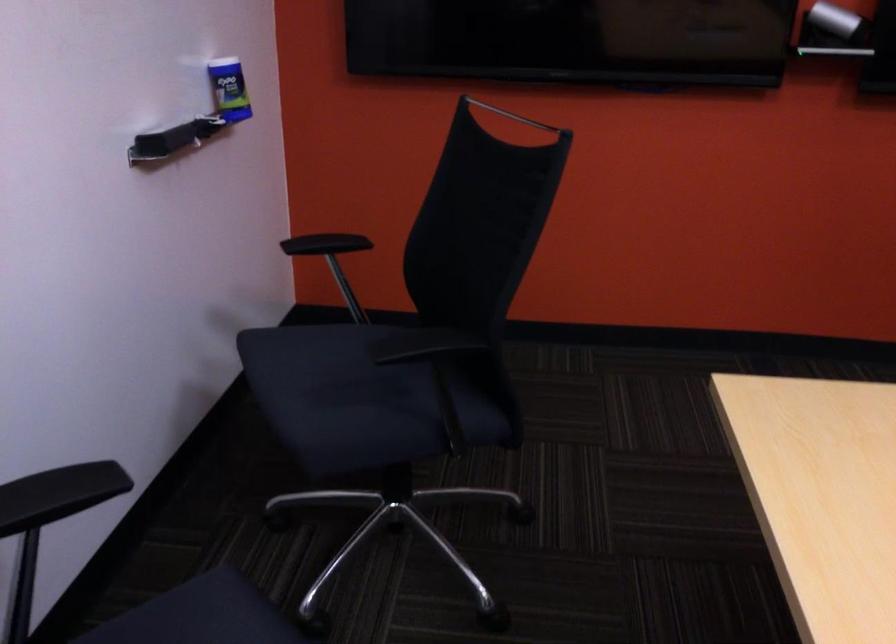
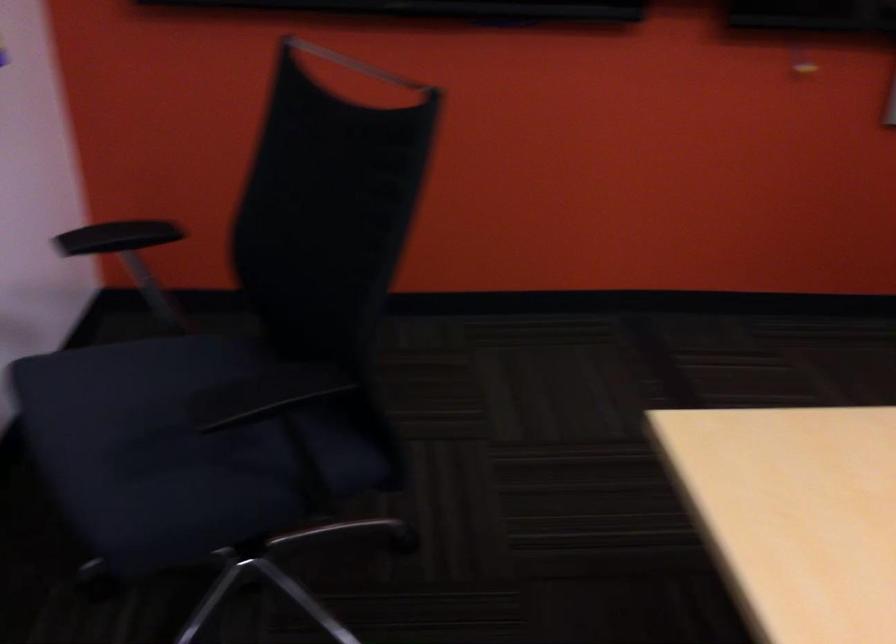
Find the pixel in the second image that matches (x=346, y=390) in the first image.

(167, 442)